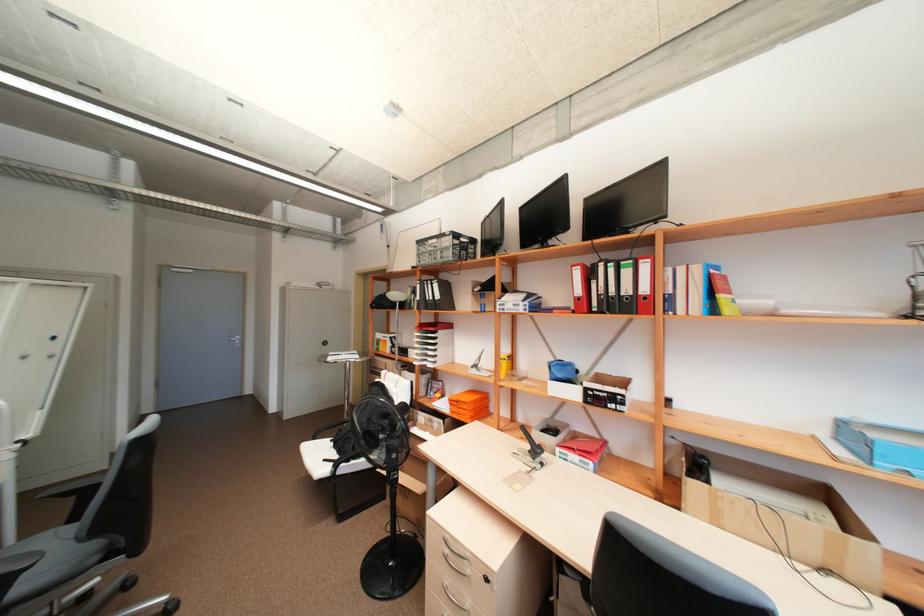
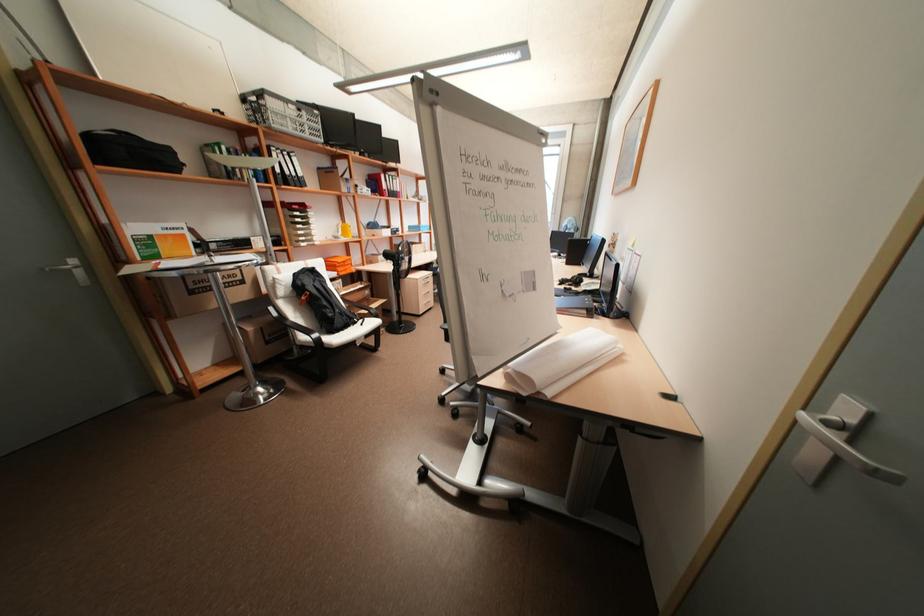
Question: I am providing you with two images of the same scene from different viewpoints. Which of the following objects are not visible in image2?

Choices:
 (A) white round knob
 (B) book
 (C) black plastic crate
 (D) black binder

Answer: (B)